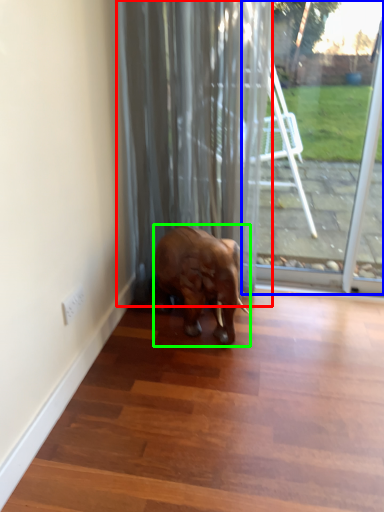
Question: Based on their relative distances, which object is nearer to curtain (highlighted by a red box)? Choose from glass door (highlighted by a blue box) and elephant (highlighted by a green box).

Choices:
 (A) glass door
 (B) elephant

Answer: (B)